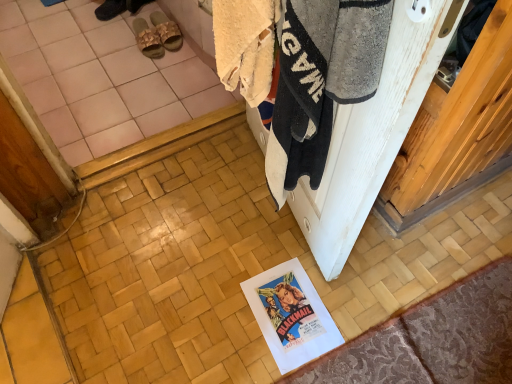
Question: From a real-world perspective, is white fluffy towel at upper right beneath white paper at lower center?

Choices:
 (A) no
 (B) yes

Answer: (A)

Question: Is white fluffy towel at upper right at the left side of white paper at lower center?

Choices:
 (A) no
 (B) yes

Answer: (B)

Question: Is white fluffy towel at upper right next to white paper at lower center?

Choices:
 (A) yes
 (B) no

Answer: (B)

Question: Is white fluffy towel at upper right not near white paper at lower center?

Choices:
 (A) yes
 (B) no

Answer: (B)

Question: Is the position of white fluffy towel at upper right less distant than that of white paper at lower center?

Choices:
 (A) no
 (B) yes

Answer: (B)

Question: Can you confirm if white fluffy towel at upper right is thinner than white paper at lower center?

Choices:
 (A) yes
 (B) no

Answer: (A)

Question: Is patterned fabric doormat at lower right facing away from white paper at lower center?

Choices:
 (A) no
 (B) yes

Answer: (B)

Question: Considering the relative sizes of patterned fabric doormat at lower right and white paper at lower center in the image provided, is patterned fabric doormat at lower right wider than white paper at lower center?

Choices:
 (A) yes
 (B) no

Answer: (A)

Question: Is patterned fabric doormat at lower right shorter than white paper at lower center?

Choices:
 (A) yes
 (B) no

Answer: (B)

Question: Is patterned fabric doormat at lower right facing towards white paper at lower center?

Choices:
 (A) no
 (B) yes

Answer: (A)

Question: Considering the relative positions of patterned fabric doormat at lower right and white paper at lower center in the image provided, is patterned fabric doormat at lower right to the left of white paper at lower center from the viewer's perspective?

Choices:
 (A) yes
 (B) no

Answer: (B)

Question: From the image's perspective, would you say patterned fabric doormat at lower right is positioned over white paper at lower center?

Choices:
 (A) yes
 (B) no

Answer: (B)

Question: Can you confirm if patterned fabric doormat at lower right is positioned to the left of beige woven slipper at upper left, the 1th footwear in the right-to-left sequence?

Choices:
 (A) yes
 (B) no

Answer: (B)